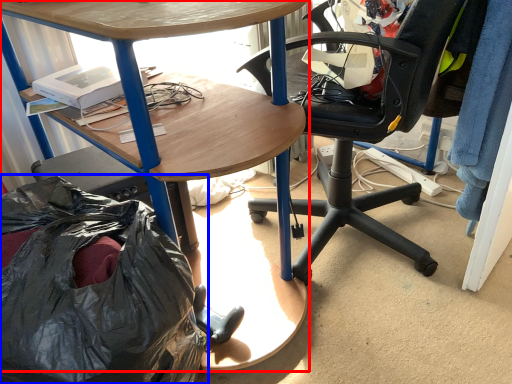
Question: Which object is further to the camera taking this photo, desk (highlighted by a red box) or garbage (highlighted by a blue box)?

Choices:
 (A) desk
 (B) garbage

Answer: (A)